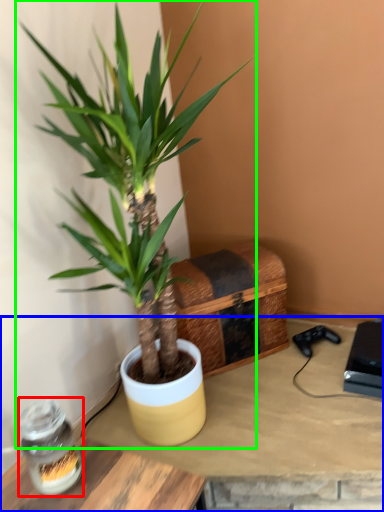
Question: Considering the real-world distances, which object is farthest from glass jar (highlighted by a red box)? table (highlighted by a blue box) or houseplant (highlighted by a green box)?

Choices:
 (A) table
 (B) houseplant

Answer: (B)